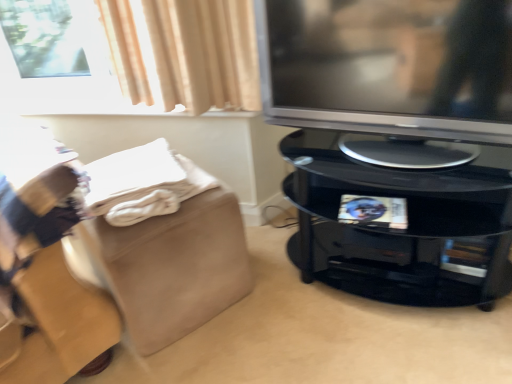
Where is `vacant space situated above glossy black tv stand at right (from a real-world perspective)`? This screenshot has width=512, height=384. vacant space situated above glossy black tv stand at right (from a real-world perspective) is located at coordinates (394, 152).